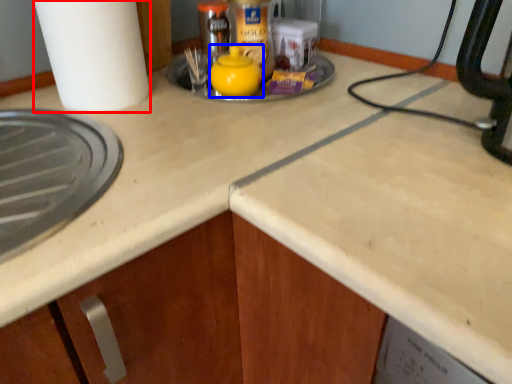
Question: Which of the following is the farthest to the observer, paper towel (highlighted by a red box) or tea pot (highlighted by a blue box)?

Choices:
 (A) paper towel
 (B) tea pot

Answer: (B)